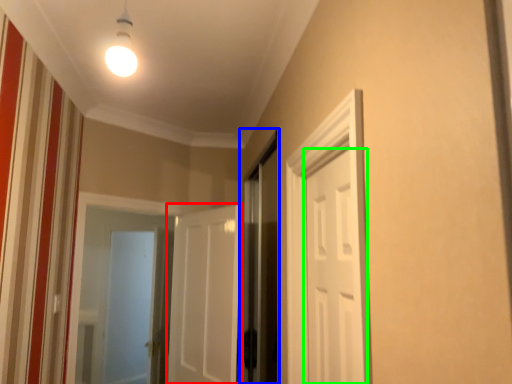
Question: Which object is the closest to the door (highlighted by a red box)? Choose among these: screen door (highlighted by a blue box) or door (highlighted by a green box).

Choices:
 (A) screen door
 (B) door

Answer: (A)